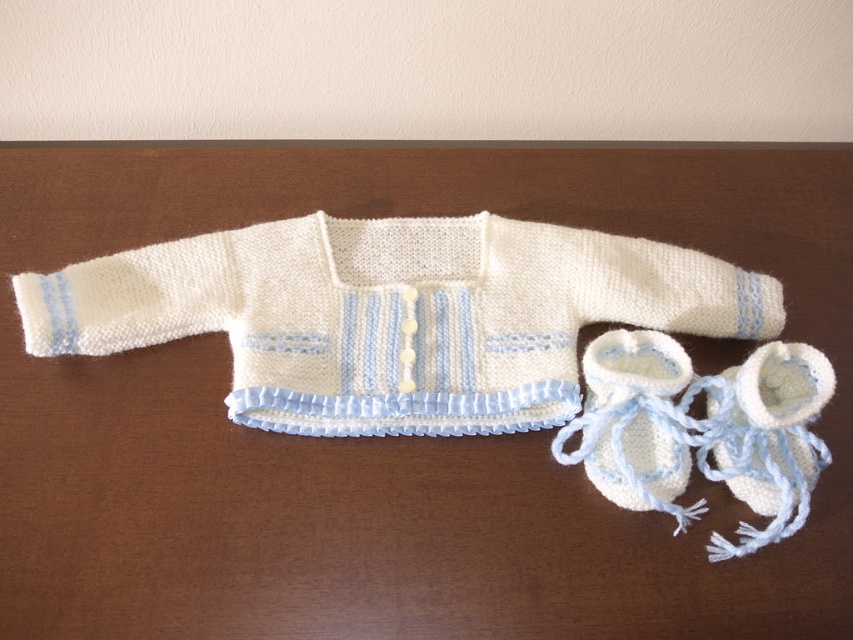
Question: In this image, where is white knitted bootie at lower right located relative to white knitted booties at lower right?

Choices:
 (A) above
 (B) below

Answer: (B)

Question: Considering the relative positions of white knitted bootie at lower right and white knitted booties at lower right in the image provided, where is white knitted bootie at lower right located with respect to white knitted booties at lower right?

Choices:
 (A) below
 (B) above

Answer: (A)

Question: Does white knitted sweater at center appear under white knitted bootie at lower right?

Choices:
 (A) yes
 (B) no

Answer: (B)

Question: Which of the following is the closest to the observer?

Choices:
 (A) (782, 524)
 (B) (408, 356)
 (C) (630, 477)

Answer: (A)

Question: Which object appears farthest from the camera in this image?

Choices:
 (A) white knitted sweater at center
 (B) white knitted booties at lower right

Answer: (A)

Question: Which of the following is the farthest from the observer?

Choices:
 (A) (822, 364)
 (B) (712, 288)
 (C) (648, 339)

Answer: (B)